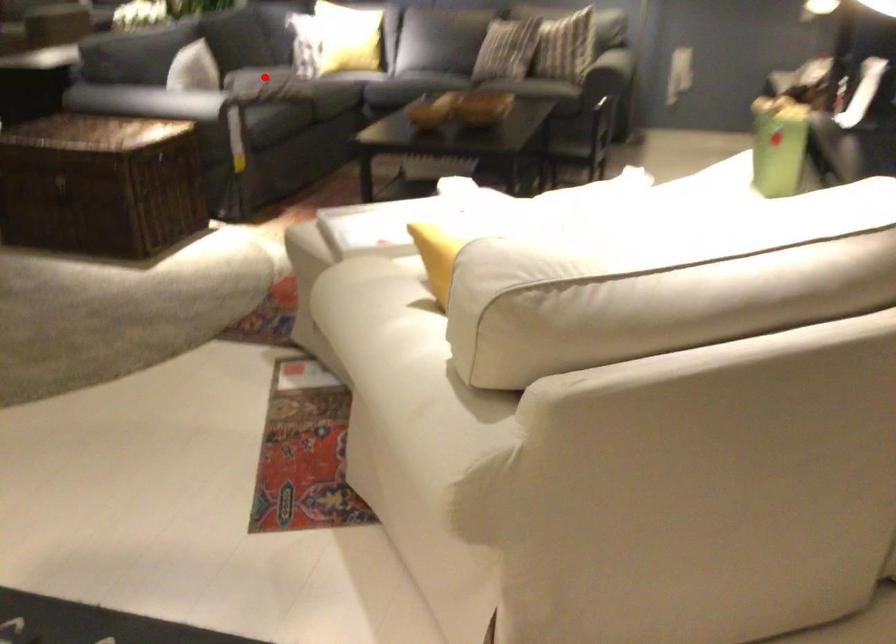
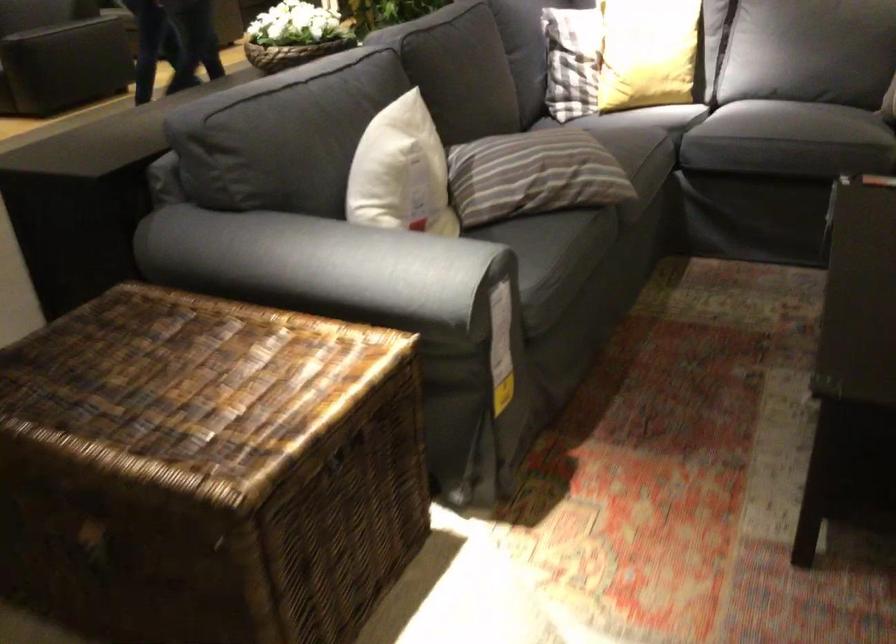
Question: A red point is marked in image1. In image2, is the corresponding 3D point closer to the camera or farther? Reply with the corresponding letter.

Choices:
 (A) The corresponding 3D point is closer.
 (B) The corresponding 3D point is farther.

Answer: (A)